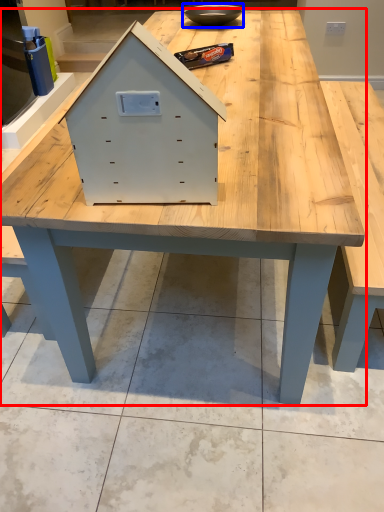
Question: Among these objects, which one is nearest to the camera, table (highlighted by a red box) or bowl (highlighted by a blue box)?

Choices:
 (A) table
 (B) bowl

Answer: (A)